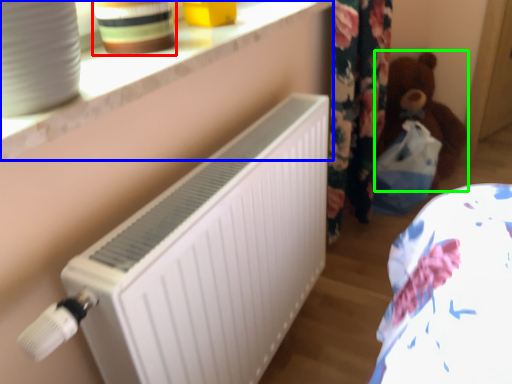
Question: Considering the real-world distances, which object is closest to pottery (highlighted by a red box)? window sill (highlighted by a blue box) or teddy (highlighted by a green box).

Choices:
 (A) window sill
 (B) teddy

Answer: (A)